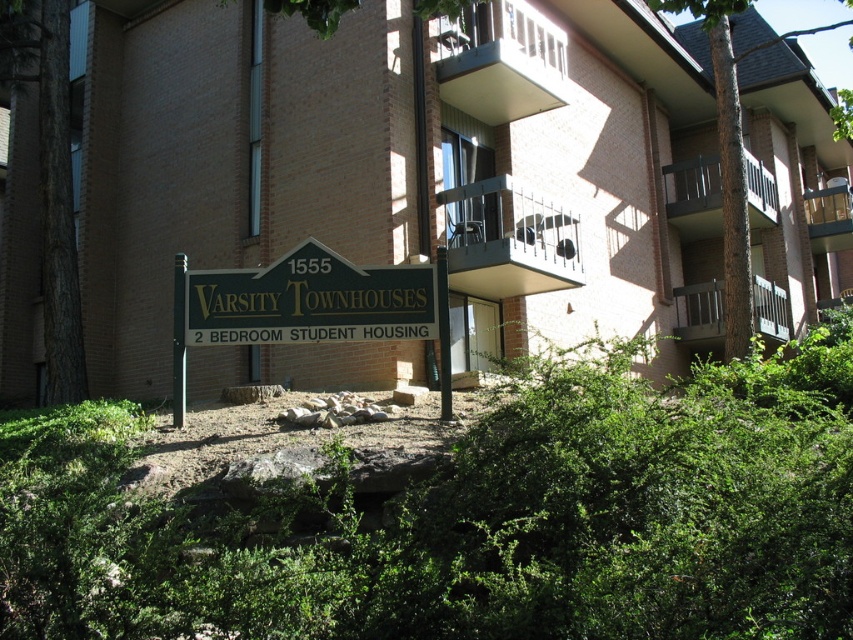
You are a student living in this building and want to hang a small wind chime on the wooden railing at upper right. However, you are concerned that the brown rough bark tree at left might block the wind. Based on their heights, can you determine if the tree will block the wind from reaching the railing?

The brown rough bark tree at left is taller than the wooden railing at upper right. Therefore, it might block some wind from reaching the wooden railing at upper right, but since the railing is at the upper right, it could still catch wind from other directions.

You are a student living in the building and want to hang a small potted plant on the wooden railing at upper right. However, you notice the brown rough bark tree at left nearby. Will the tree block the railing from view when viewed from below?

The brown rough bark tree at left is positioned over the wooden railing at upper right, so it will block the railing from view when viewed from below.